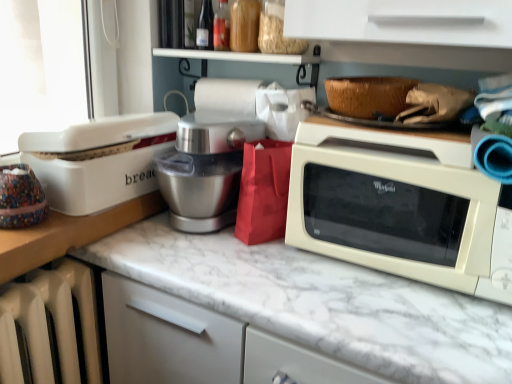
Question: From the image's perspective, is translucent glass bottle at upper center positioned above or below white glossy microwave at right?

Choices:
 (A) above
 (B) below

Answer: (A)

Question: Choose the correct answer: Is translucent glass bottle at upper center inside white glossy microwave at right or outside it?

Choices:
 (A) inside
 (B) outside

Answer: (B)

Question: Which object is positioned closest to the white marble countertop at center?

Choices:
 (A) white plastic bread box at left
 (B) woven brown basket at upper right
 (C) translucent glass bottle at upper center
 (D) white glossy microwave at right
 (E) translucent glass jars at upper center

Answer: (D)

Question: Estimate the real-world distances between objects in this image. Which object is closer to the white glossy microwave at right?

Choices:
 (A) translucent glass bottle at upper center
 (B) translucent glass jars at upper center
 (C) woven brown basket at upper right
 (D) silver metallic mixer at center
 (E) white plastic bread box at left

Answer: (C)